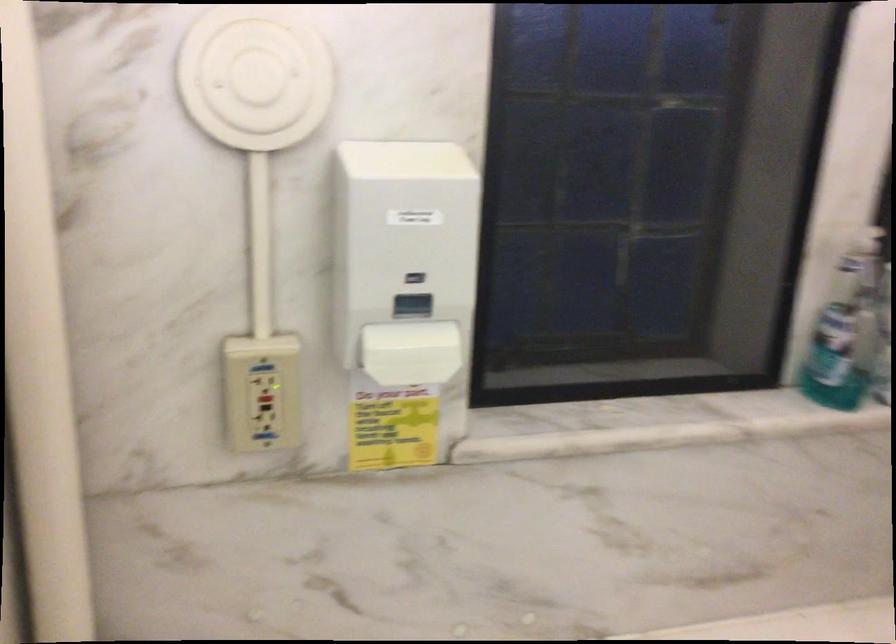
Find where to push the red outlet button. Please return your answer as a coordinate pair (x, y).

(262, 397)